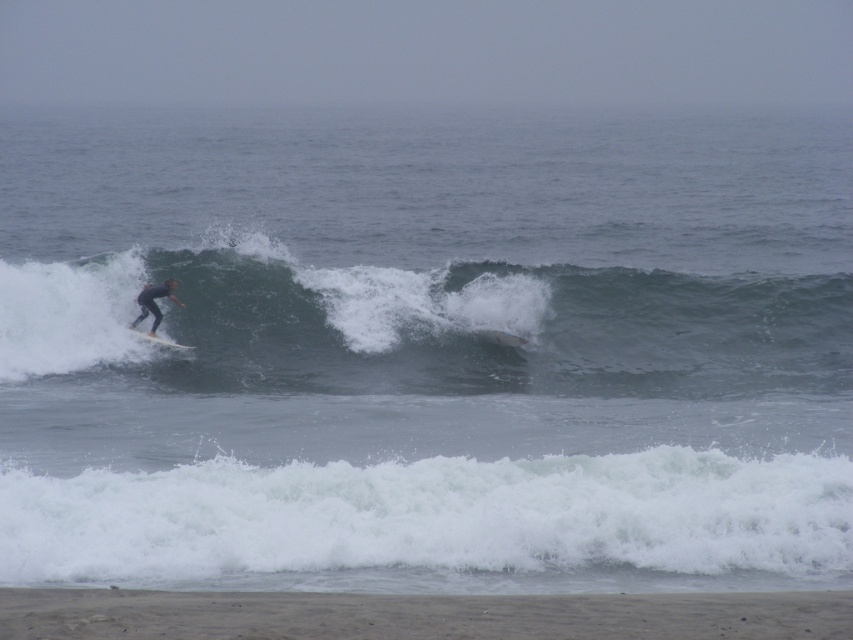
You are a photographer trying to capture the surfer on the white surfboard on the left side of the frame. You notice a point marked at coordinates (438, 524). Based on the scene, where is this point located?

The point at coordinates (438, 524) is on the white foamy wave at lower center.

You are a photographer trying to capture the surfer in the image. You notice the smooth gray wave at center and the dark blue wetsuit at center. Which object is positioned higher in the frame?

The smooth gray wave at center is above the dark blue wetsuit at center, so it is positioned higher in the frame.

You are a photographer trying to capture the surfer in the image. Since you want to focus on the surfer, which object should you zoom in on more, the dark blue wetsuit at center or the white matte surfboard at left?

The dark blue wetsuit at center is larger in size than the white matte surfboard at left, so you should zoom in on the dark blue wetsuit at center to focus on the surfer.